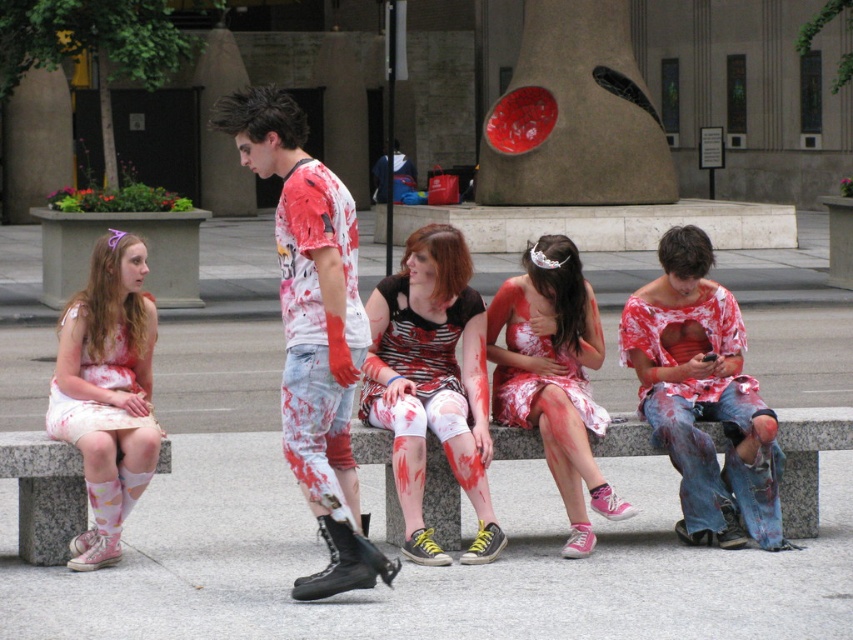
Between white floral dress at left and matte pink dress at center, which one is positioned lower?

white floral dress at left is below.

Is white floral dress at left taller than matte pink dress at center?

Yes.

Is point (103, 289) farther from viewer compared to point (599, 332)?

No, (103, 289) is closer to viewer.

Where is `white floral dress at left`? Image resolution: width=853 pixels, height=640 pixels. white floral dress at left is located at coordinates coord(107,392).

Is striped jersey at center to the left of matte pink dress at center from the viewer's perspective?

Correct, you'll find striped jersey at center to the left of matte pink dress at center.

Can you confirm if striped jersey at center is positioned to the right of matte pink dress at center?

Incorrect, striped jersey at center is not on the right side of matte pink dress at center.

You are a GUI agent. You are given a task and a screenshot of the screen. Output one action in this format:
    pyautogui.click(x=<x>, y=<y>)
    Task: Click on the striped jersey at center
    The image size is (853, 640).
    Given the screenshot: What is the action you would take?
    pyautogui.click(x=431, y=384)

Can you confirm if painted fabric shirt at center is shorter than matte red shirt at center?

No, painted fabric shirt at center is not shorter than matte red shirt at center.

Is painted fabric shirt at center taller than matte red shirt at center?

Yes.

What do you see at coordinates (312, 328) in the screenshot? The height and width of the screenshot is (640, 853). I see `painted fabric shirt at center` at bounding box center [312, 328].

Locate an element on the screen. The height and width of the screenshot is (640, 853). painted fabric shirt at center is located at coordinates (312, 328).